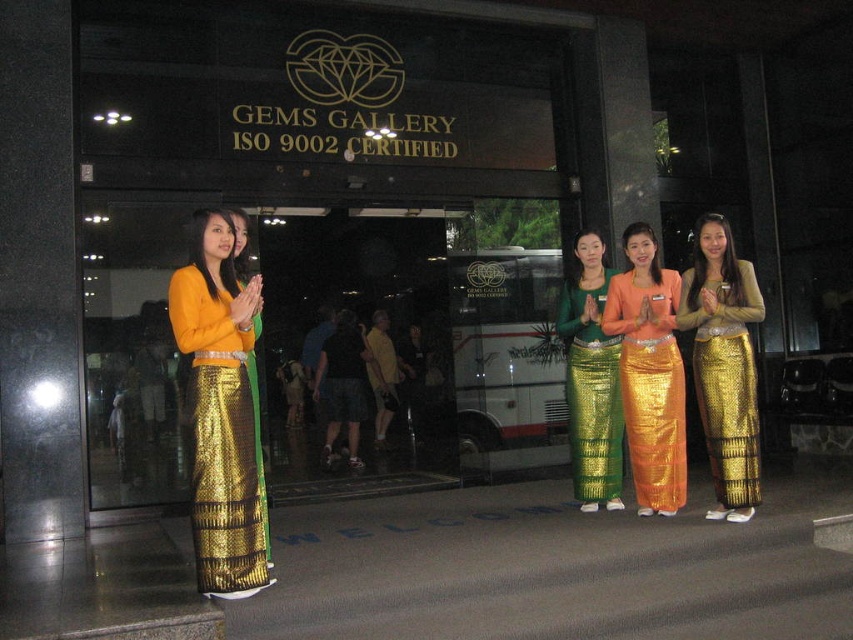
Which of these two, matte gold skirt at left or gold sequined skirt at center, stands shorter?

matte gold skirt at left is shorter.

Which is more to the left, matte gold skirt at left or gold sequined skirt at center?

matte gold skirt at left is more to the left.

I want to click on matte gold skirt at left, so click(221, 412).

Find the location of `matte gold skirt at left`. matte gold skirt at left is located at coordinates (221, 412).

What do you see at coordinates (221, 412) in the screenshot? The height and width of the screenshot is (640, 853). I see `matte gold skirt at left` at bounding box center [221, 412].

Can you confirm if matte gold skirt at left is positioned to the left of green sequined skirt at center?

Yes, matte gold skirt at left is to the left of green sequined skirt at center.

The height and width of the screenshot is (640, 853). Find the location of `matte gold skirt at left`. matte gold skirt at left is located at coordinates [221, 412].

Is gold sequined skirt at center smaller than orange sequined skirt at center?

No.

Looking at this image, who is more distant from viewer, [726,260] or [682,419]?

The point [726,260] is behind.

The width and height of the screenshot is (853, 640). I want to click on gold sequined skirt at center, so click(x=724, y=364).